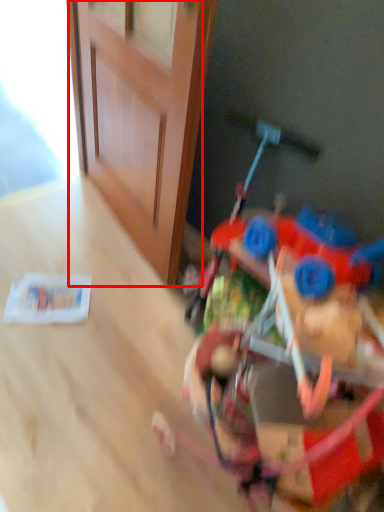
Question: Considering the relative positions of door (annotated by the red box) and toy in the image provided, where is door (annotated by the red box) located with respect to the staircase?

Choices:
 (A) left
 (B) right

Answer: (A)